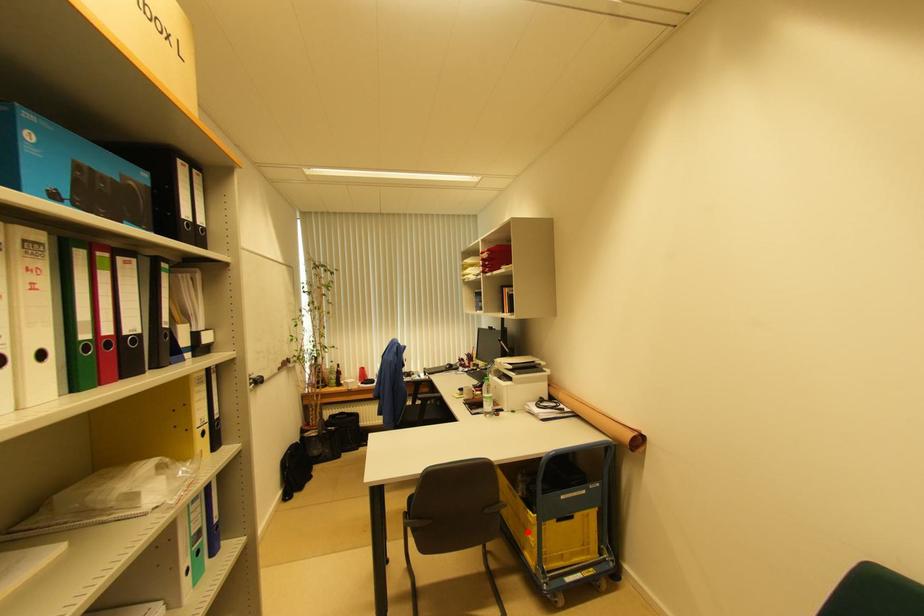
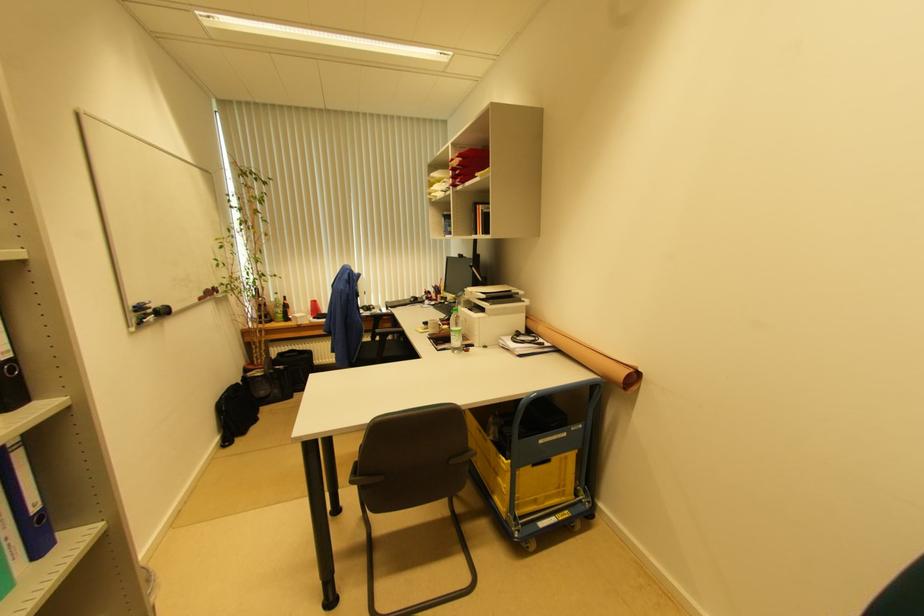
Locate, in the second image, the point that corresponds to the highlighted location in the first image.

(499, 477)